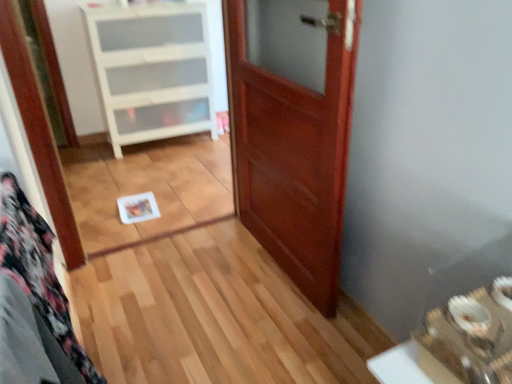
The height and width of the screenshot is (384, 512). Identify the location of free space in front of mahogany wood door at center. (264, 326).